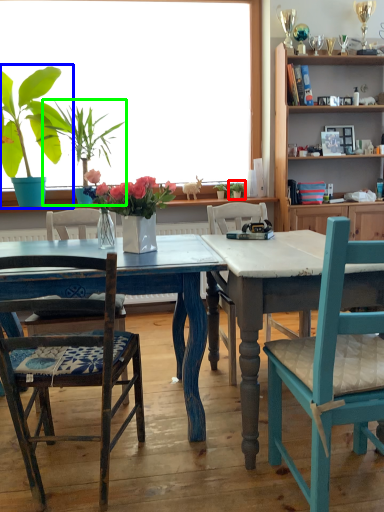
Question: Which object is positioned closest to houseplant (highlighted by a red box)? Select from houseplant (highlighted by a blue box) and houseplant (highlighted by a green box).

Choices:
 (A) houseplant
 (B) houseplant

Answer: (B)